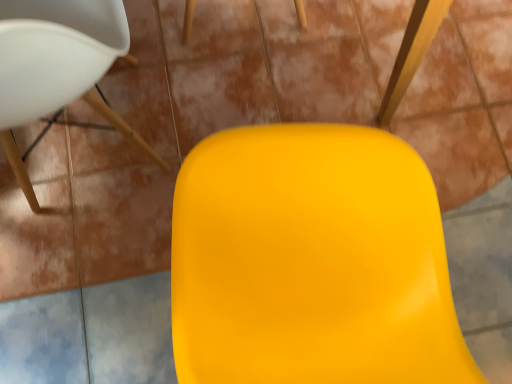
Question: Could you tell me if matte white chair at upper left is turned towards glossy plastic swivel chair at center?

Choices:
 (A) no
 (B) yes

Answer: (A)

Question: Is matte white chair at upper left outside glossy plastic swivel chair at center?

Choices:
 (A) yes
 (B) no

Answer: (A)

Question: Can you confirm if matte white chair at upper left is bigger than glossy plastic swivel chair at center?

Choices:
 (A) yes
 (B) no

Answer: (A)

Question: From the image's perspective, is matte white chair at upper left above glossy plastic swivel chair at center?

Choices:
 (A) yes
 (B) no

Answer: (A)

Question: Is matte white chair at upper left further to the viewer compared to glossy plastic swivel chair at center?

Choices:
 (A) no
 (B) yes

Answer: (B)

Question: Considering the relative positions of matte white chair at upper left and glossy plastic swivel chair at center in the image provided, is matte white chair at upper left to the right of glossy plastic swivel chair at center from the viewer's perspective?

Choices:
 (A) no
 (B) yes

Answer: (A)

Question: Is glossy plastic swivel chair at center to the left of matte white chair at upper left from the viewer's perspective?

Choices:
 (A) no
 (B) yes

Answer: (A)

Question: Is glossy plastic swivel chair at center not inside matte white chair at upper left?

Choices:
 (A) yes
 (B) no

Answer: (A)

Question: Is glossy plastic swivel chair at center further to the viewer compared to matte white chair at upper left?

Choices:
 (A) yes
 (B) no

Answer: (B)

Question: Would you say matte white chair at upper left is part of glossy plastic swivel chair at center's contents?

Choices:
 (A) yes
 (B) no

Answer: (B)

Question: Is glossy plastic swivel chair at center oriented away from matte white chair at upper left?

Choices:
 (A) no
 (B) yes

Answer: (A)

Question: Does glossy plastic swivel chair at center have a lesser width compared to matte white chair at upper left?

Choices:
 (A) no
 (B) yes

Answer: (B)

Question: In the image, is matte white chair at upper left on the left side or the right side of glossy plastic swivel chair at center?

Choices:
 (A) right
 (B) left

Answer: (B)